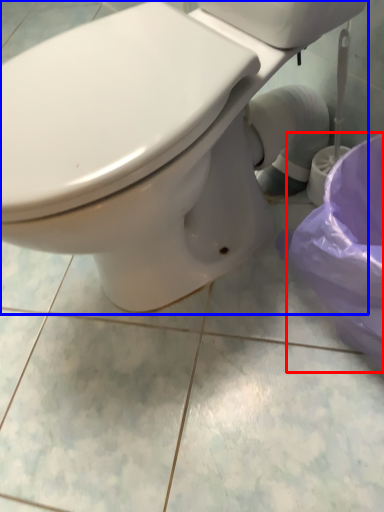
Question: Which object is further to the camera taking this photo, potty (highlighted by a red box) or toilet (highlighted by a blue box)?

Choices:
 (A) potty
 (B) toilet

Answer: (A)